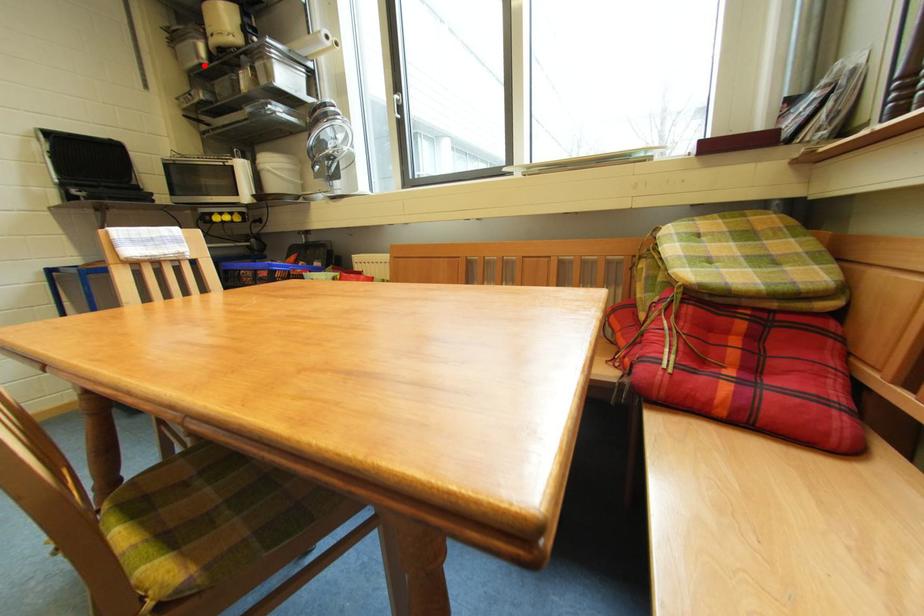
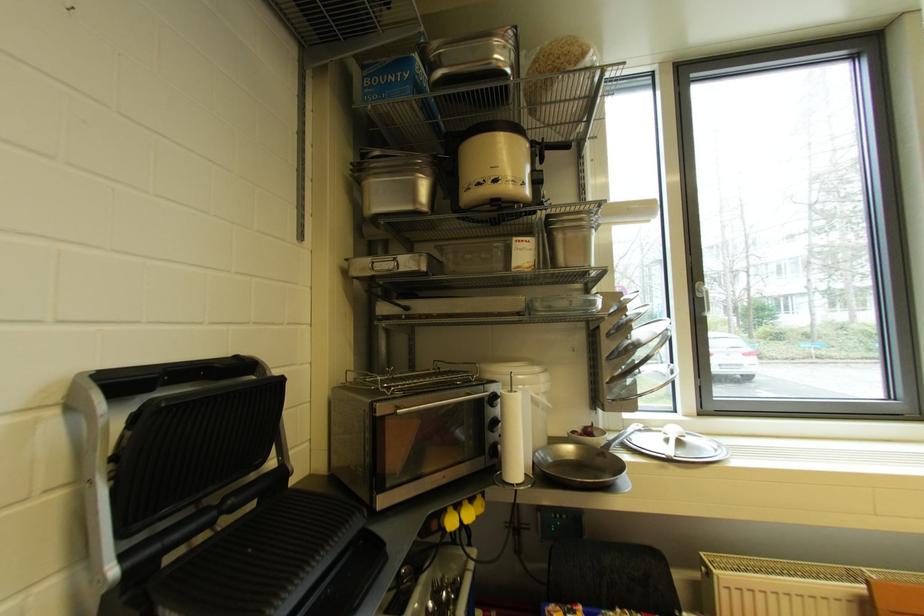
Where in the second image is the point corresponding to the highlighted location from the first image?

(418, 211)